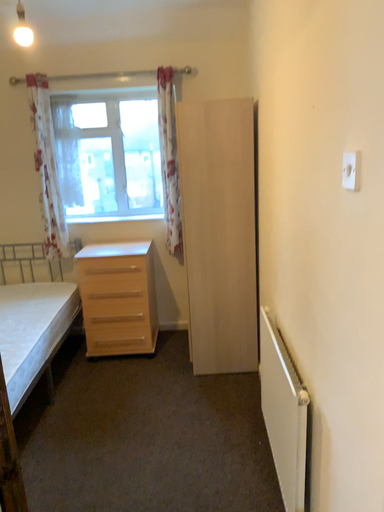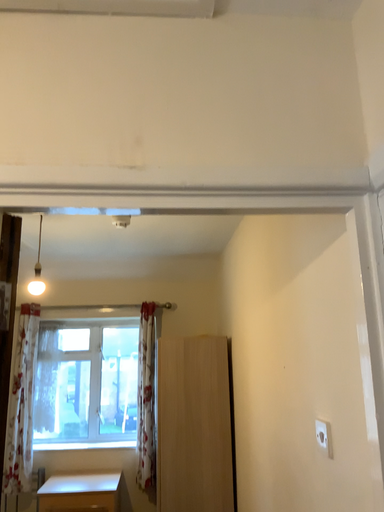
Question: Which way did the camera rotate in the video?

Choices:
 (A) rotated upward
 (B) rotated downward

Answer: (A)